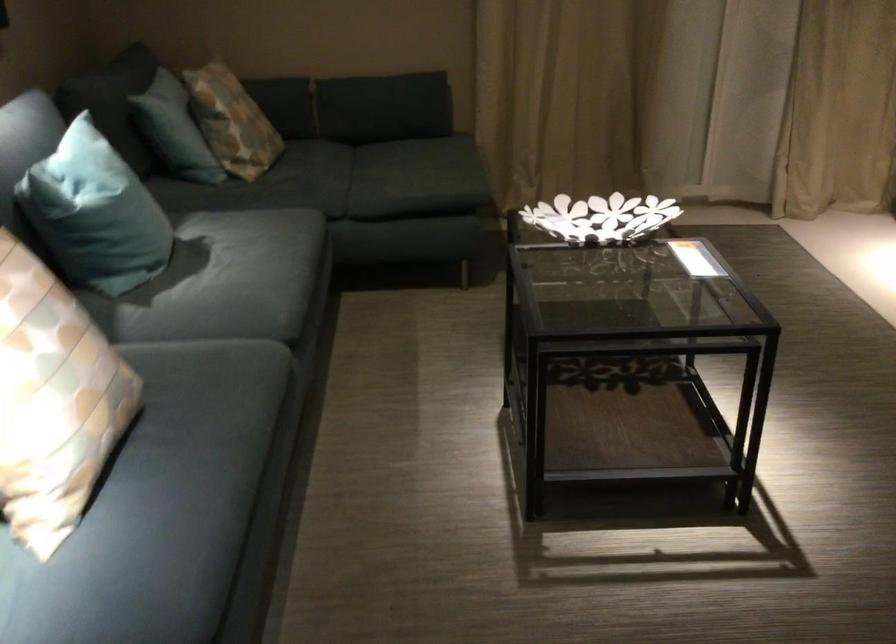
This screenshot has width=896, height=644. What do you see at coordinates (197, 436) in the screenshot? I see `a sofa sitting surface` at bounding box center [197, 436].